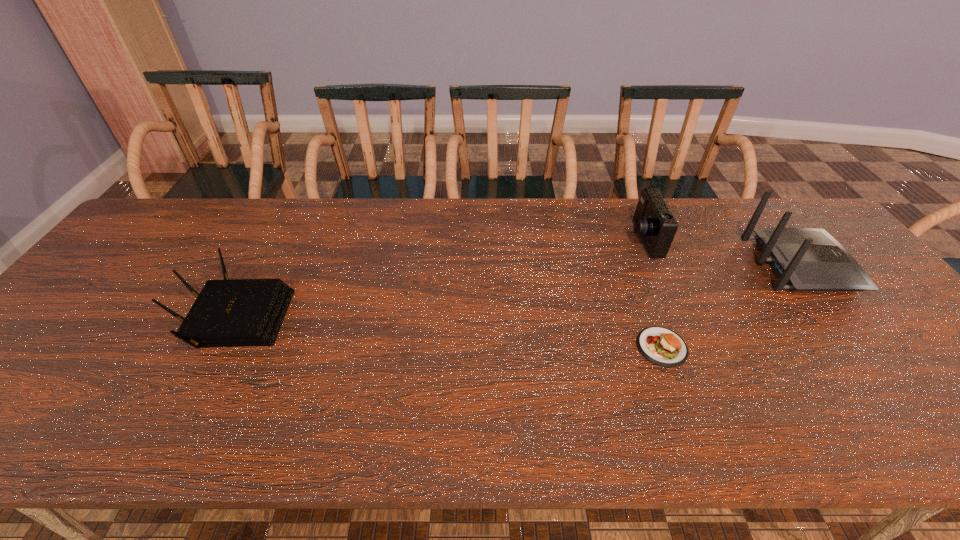
The height and width of the screenshot is (540, 960). What are the coordinates of `free space located on the left of the shortest object` in the screenshot? It's located at (493, 347).

The height and width of the screenshot is (540, 960). I want to click on router located in the far edge section of the desktop, so click(807, 259).

At what (x,y) coordinates should I click in order to perform the action: click on camera situated at the far edge. Please return your answer as a coordinate pair (x, y). Looking at the image, I should click on (654, 222).

The height and width of the screenshot is (540, 960). In order to click on object at the right edge in this screenshot , I will do `click(807, 259)`.

Locate an element on the screen. object present at the far right corner is located at coordinates (807, 259).

Where is `vacant space at the far edge`? vacant space at the far edge is located at coordinates (477, 210).

The width and height of the screenshot is (960, 540). In the image, there is a desktop. What are the coordinates of `vacant space at the near edge` in the screenshot? It's located at (882, 440).

This screenshot has width=960, height=540. In the image, there is a desktop. Find the location of `vacant space at the left edge`. vacant space at the left edge is located at coordinates (53, 353).

Where is `vacant space at the far right corner of the desktop`? The width and height of the screenshot is (960, 540). vacant space at the far right corner of the desktop is located at coordinates (804, 216).

Where is `free space between the camera and the right router`? This screenshot has height=540, width=960. free space between the camera and the right router is located at coordinates (722, 252).